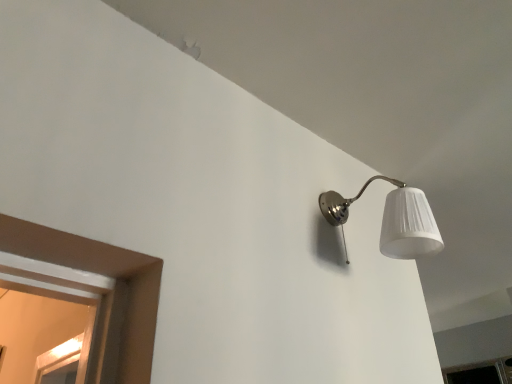
Question: Is transparent glass window at lower right positioned beyond the bounds of satin nickel lampshade at upper right?

Choices:
 (A) no
 (B) yes

Answer: (B)

Question: From a real-world perspective, is transparent glass window at lower right located higher than satin nickel lampshade at upper right?

Choices:
 (A) no
 (B) yes

Answer: (A)

Question: From the image's perspective, does transparent glass window at lower right appear higher than satin nickel lampshade at upper right?

Choices:
 (A) no
 (B) yes

Answer: (A)

Question: Is transparent glass window at lower right wider than satin nickel lampshade at upper right?

Choices:
 (A) no
 (B) yes

Answer: (B)

Question: Can you confirm if transparent glass window at lower right is positioned to the right of satin nickel lampshade at upper right?

Choices:
 (A) yes
 (B) no

Answer: (A)

Question: Is transparent glass window at lower right positioned with its back to satin nickel lampshade at upper right?

Choices:
 (A) no
 (B) yes

Answer: (A)

Question: Is satin nickel lampshade at upper right aimed at transparent glass window at lower right?

Choices:
 (A) no
 (B) yes

Answer: (A)

Question: Can you confirm if satin nickel lampshade at upper right is taller than transparent glass window at lower right?

Choices:
 (A) no
 (B) yes

Answer: (B)

Question: Is satin nickel lampshade at upper right at the right side of transparent glass window at lower right?

Choices:
 (A) no
 (B) yes

Answer: (A)

Question: Can you confirm if satin nickel lampshade at upper right is bigger than transparent glass window at lower right?

Choices:
 (A) yes
 (B) no

Answer: (B)

Question: Is satin nickel lampshade at upper right wider than transparent glass window at lower right?

Choices:
 (A) no
 (B) yes

Answer: (A)

Question: Considering the relative sizes of satin nickel lampshade at upper right and transparent glass window at lower right in the image provided, is satin nickel lampshade at upper right shorter than transparent glass window at lower right?

Choices:
 (A) no
 (B) yes

Answer: (A)

Question: In the image, is transparent glass window at lower right positioned in front of or behind satin nickel lampshade at upper right?

Choices:
 (A) front
 (B) behind

Answer: (B)